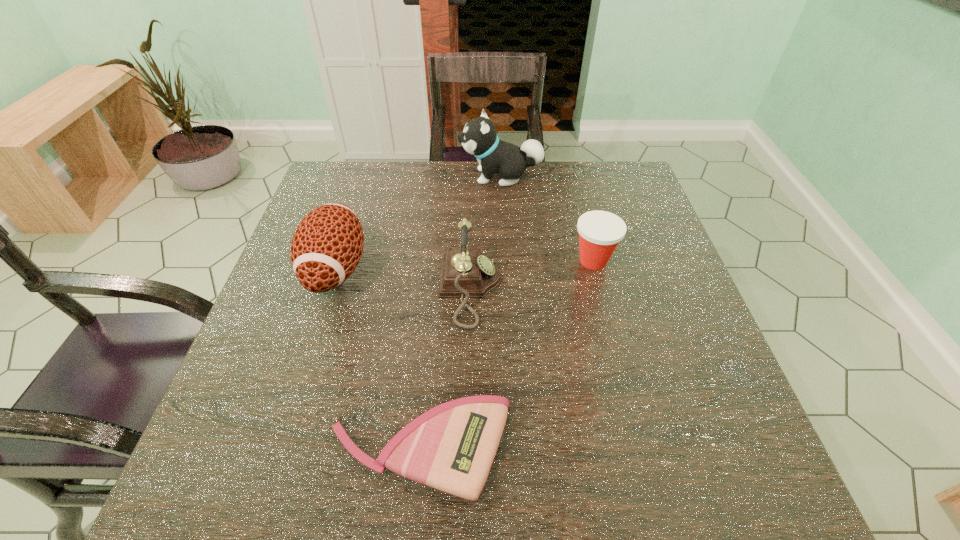
The image size is (960, 540). I want to click on the farthest object, so click(x=479, y=138).

Locate an element on the screen. The width and height of the screenshot is (960, 540). the tallest object is located at coordinates (479, 138).

Find the location of a particular element. football is located at coordinates (326, 248).

Where is `telephone`? telephone is located at coordinates (465, 273).

Find the location of `the fourth tallest object`. the fourth tallest object is located at coordinates (600, 232).

Identify the location of Dixie cup. The image size is (960, 540). (600, 232).

What are the coordinates of `the shortest object` in the screenshot? It's located at (451, 447).

At what (x,y) coordinates should I click in order to perform the action: click on the nearest object. Please return your answer as a coordinate pair (x, y). The width and height of the screenshot is (960, 540). Looking at the image, I should click on (451, 447).

Identify the location of free space located 0.240m at the face of the tallest object. (378, 176).

Where is `blank space located 0.090m at the face of the tallest object`? The height and width of the screenshot is (540, 960). blank space located 0.090m at the face of the tallest object is located at coordinates (428, 176).